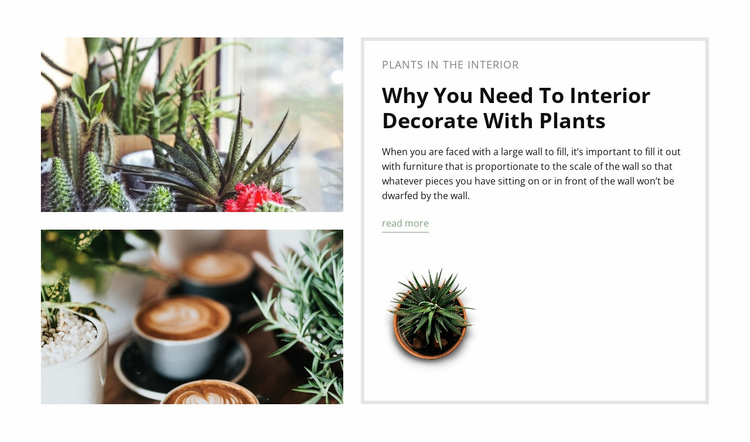
You are a GUI agent. You are given a task and a screenshot of the screen. Output one action in this format:
    pyautogui.click(x=<x>, y=<y>)
    Task: Click on the cup
    The width and height of the screenshot is (750, 442).
    Given the screenshot: What is the action you would take?
    pyautogui.click(x=182, y=357), pyautogui.click(x=226, y=261), pyautogui.click(x=219, y=396)